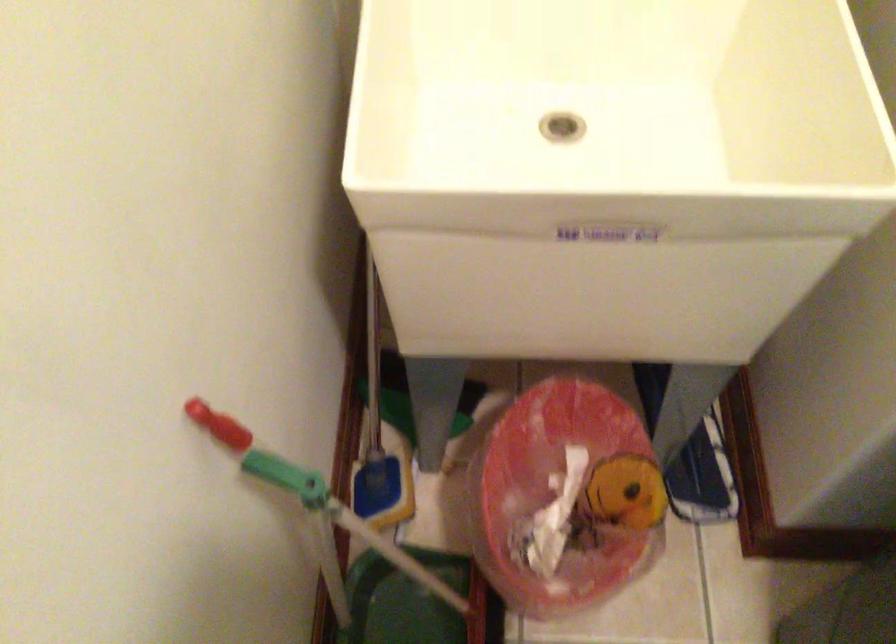
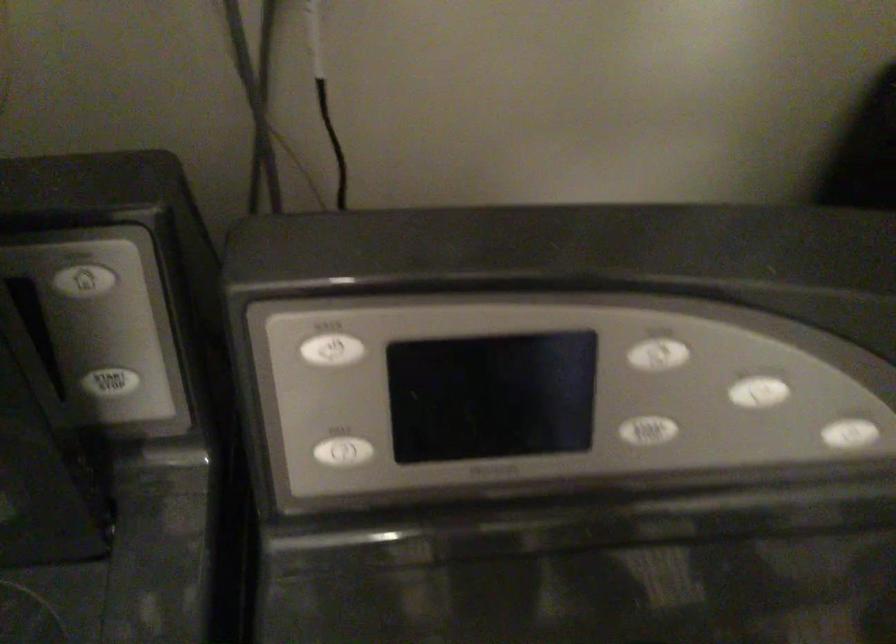
First-person continuous shooting, in which direction is the camera rotating?

The rotation direction of the camera is right-down.